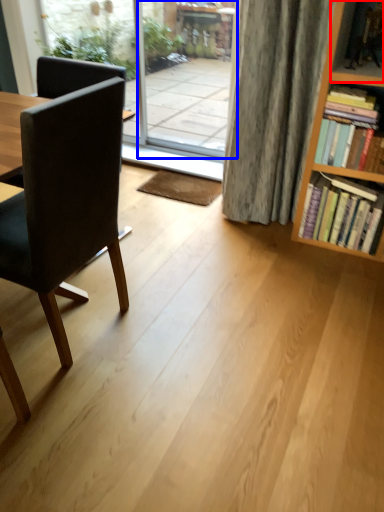
Question: Which of the following is the farthest to the observer, shelf (highlighted by a red box) or screen door (highlighted by a blue box)?

Choices:
 (A) shelf
 (B) screen door

Answer: (B)